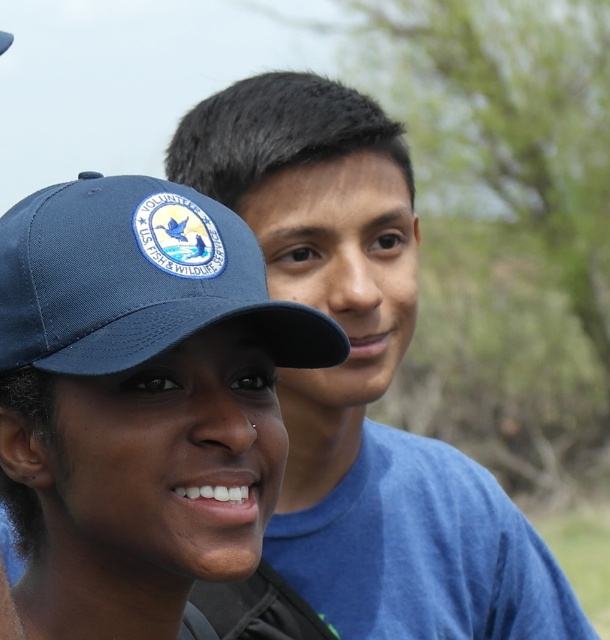
How distant is blue fabric cap at center from blue fabric baseball cap at upper left?

blue fabric cap at center and blue fabric baseball cap at upper left are 5.37 centimeters apart.

Does blue fabric cap at center appear on the right side of blue fabric baseball cap at upper left?

Incorrect, blue fabric cap at center is not on the right side of blue fabric baseball cap at upper left.

This screenshot has height=640, width=610. Find the location of `blue fabric cap at center`. blue fabric cap at center is located at coordinates (137, 400).

Between matte blue shirt at upper right and blue fabric baseball cap at upper left, which one has less height?

blue fabric baseball cap at upper left

In the scene shown: Is matte blue shirt at upper right to the left of blue fabric baseball cap at upper left from the viewer's perspective?

No, matte blue shirt at upper right is not to the left of blue fabric baseball cap at upper left.

Does point (465, 460) come in front of point (41, 368)?

No, it is not.

Where is `matte blue shirt at upper right`? matte blue shirt at upper right is located at coordinates (364, 378).

Is blue fabric cap at center positioned before matte blue shirt at upper right?

That is True.

Locate an element on the screen. blue fabric cap at center is located at coordinates (137, 400).